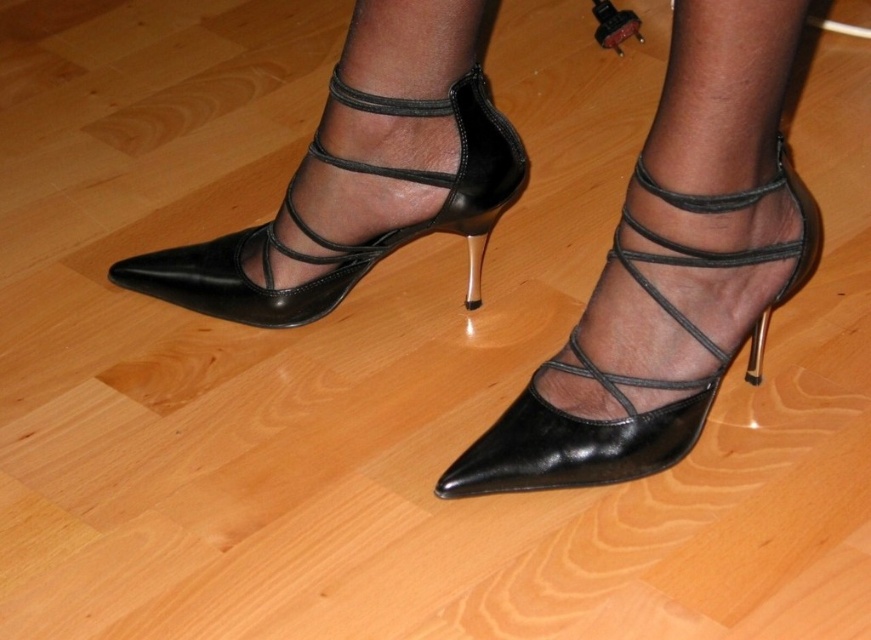
You are organizing a fashion show and need to place a small decorative item exactly at the location of the black leather sandal at center. What are the coordinates where you should place it?

The coordinates for placing the decorative item at the location of the black leather sandal at center are (630, 376).

You are a photographer setting up for a photoshoot. You need to place a small decorative item exactly at the center of the image to frame the stylish black high heeled shoes. However, you notice there is already an object at point (630, 376). What is the object located at that point?

The object at point (630, 376) is the black leather sandal at center.

You are standing in a room with a polished wooden floor and see two points marked on the floor. The first point is at coordinates point [781,252] and the second is at point [468,300]. If you were to walk from the first point to the second point, which direction would you be moving relative to your current position?

Moving towards the back.